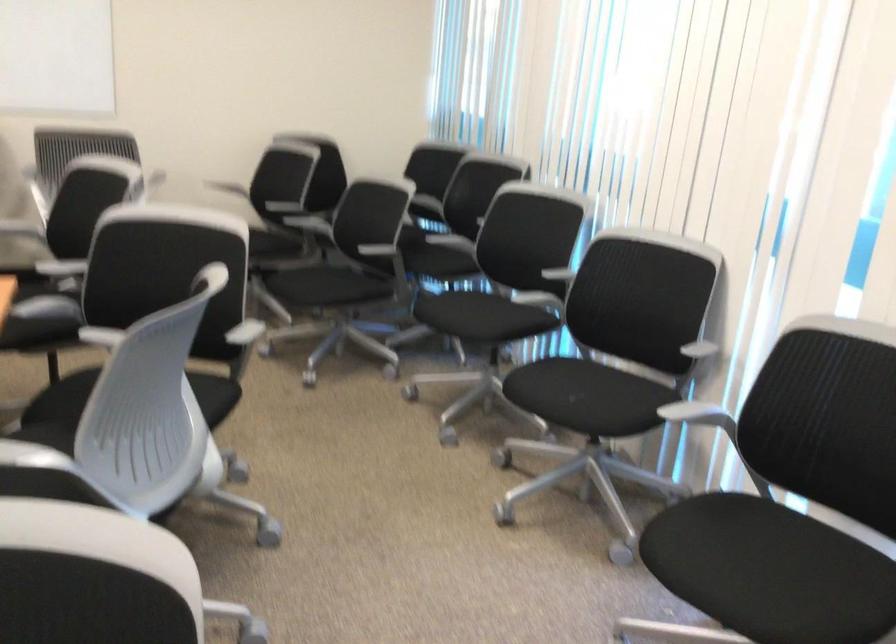
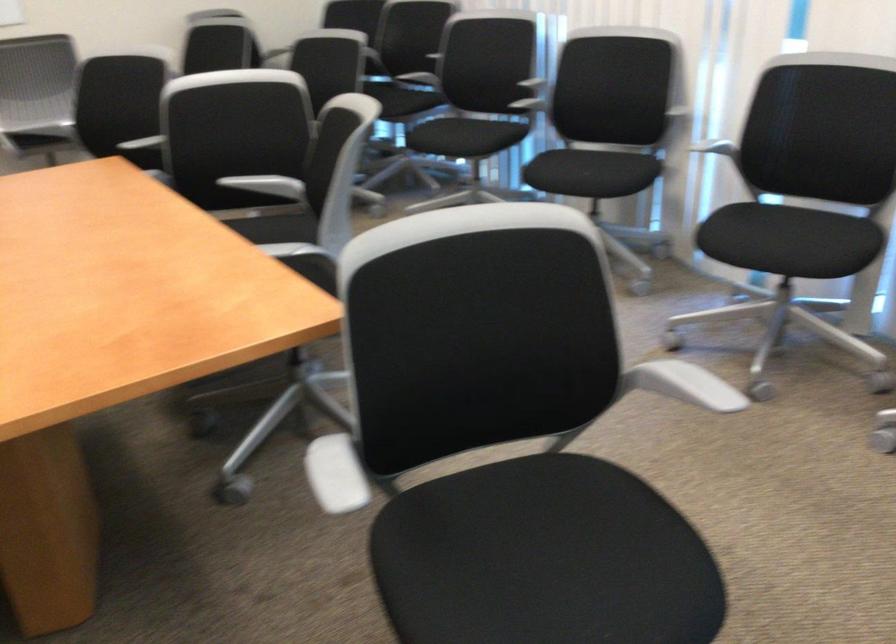
Where in the second image is the point corresponding to the point at 571,402 from the first image?

(587, 174)